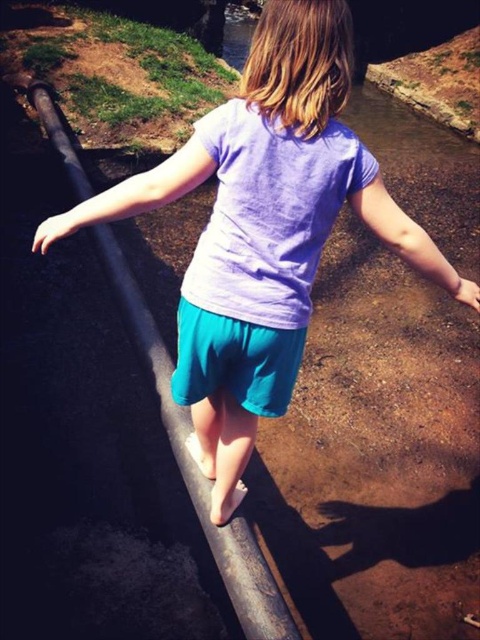
Is point (201, 483) positioned before point (199, 317)?

That is False.

Can you confirm if smooth metal rail at center is positioned below teal fabric shorts at center?

Correct, smooth metal rail at center is located below teal fabric shorts at center.

The image size is (480, 640). What do you see at coordinates (199, 470) in the screenshot?
I see `smooth metal rail at center` at bounding box center [199, 470].

Find the location of `smooth metal rail at center`. smooth metal rail at center is located at coordinates (199, 470).